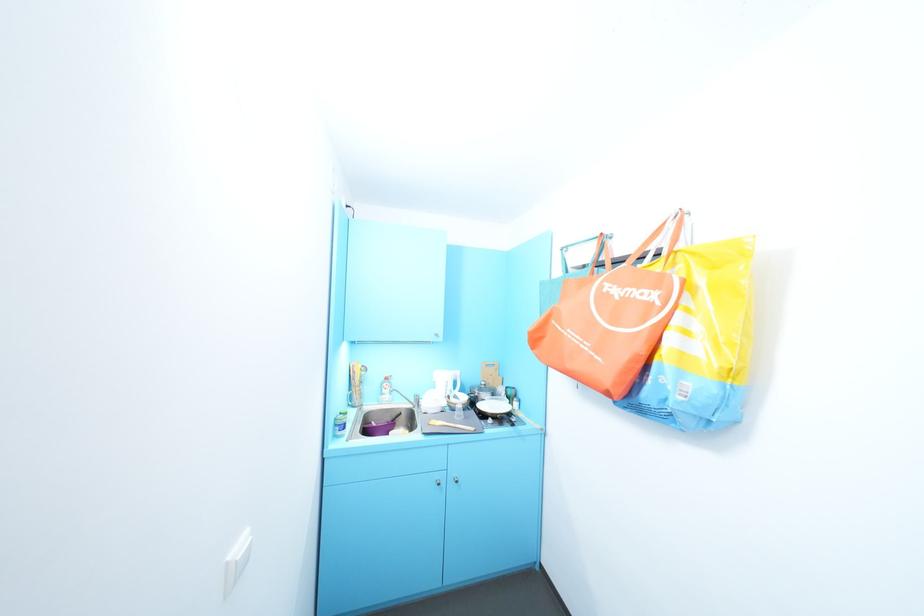
Which object does [379,427] point to?

This point indicates the purple bowl.